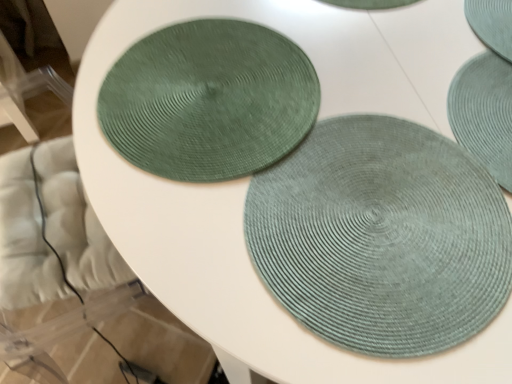
Describe the element at coordinates (209, 100) in the screenshot. This screenshot has height=384, width=512. I see `green woven coaster at upper left, the 1th coaster when ordered from left to right` at that location.

Image resolution: width=512 pixels, height=384 pixels. What do you see at coordinates (492, 24) in the screenshot? I see `teal woven coaster at upper right, positioned as the 2th coaster in left-to-right order` at bounding box center [492, 24].

Where is `green woven coaster at upper left, the 1th coaster when ordered from left to right`? The height and width of the screenshot is (384, 512). green woven coaster at upper left, the 1th coaster when ordered from left to right is located at coordinates (209, 100).

Which is more to the left, sage green woven mat at center, placed as the second mat when sorted from back to front, or teal woven coaster at upper right, the first coaster when ordered from right to left?

sage green woven mat at center, placed as the second mat when sorted from back to front, is more to the left.

Does sage green woven mat at center, arranged as the 1th mat when viewed from the front, touch teal woven coaster at upper right, the first coaster when ordered from right to left?

sage green woven mat at center, arranged as the 1th mat when viewed from the front, and teal woven coaster at upper right, the first coaster when ordered from right to left, are not in contact.

Which of these two, sage green woven mat at center, placed as the second mat when sorted from back to front, or teal woven coaster at upper right, positioned as the 2th coaster in left-to-right order, is bigger?

With larger size is sage green woven mat at center, placed as the second mat when sorted from back to front.

Which object is further away from the camera, teal woven coaster at upper right, the first coaster when ordered from right to left, or sage green woven mat at center, placed as the second mat when sorted from front to back?

teal woven coaster at upper right, the first coaster when ordered from right to left, is behind.

Who is bigger, teal woven coaster at upper right, the first coaster when ordered from right to left, or sage green woven mat at center, positioned as the 1th mat in back-to-front order?

teal woven coaster at upper right, the first coaster when ordered from right to left, is bigger.

From the image's perspective, is teal woven coaster at upper right, positioned as the 2th coaster in left-to-right order, on sage green woven mat at center, positioned as the 1th mat in back-to-front order?

Yes, from the image's perspective, teal woven coaster at upper right, positioned as the 2th coaster in left-to-right order, is on top of sage green woven mat at center, positioned as the 1th mat in back-to-front order.

Does sage green woven mat at center, arranged as the 1th mat when viewed from the front, appear on the right side of sage green woven mat at center, positioned as the 1th mat in back-to-front order?

In fact, sage green woven mat at center, arranged as the 1th mat when viewed from the front, is to the left of sage green woven mat at center, positioned as the 1th mat in back-to-front order.

Is sage green woven mat at center, placed as the second mat when sorted from back to front, further to the viewer compared to sage green woven mat at center, positioned as the 1th mat in back-to-front order?

No, it is in front of sage green woven mat at center, positioned as the 1th mat in back-to-front order.

Does point (404, 294) appear closer or farther from the camera than point (505, 67)?

Point (404, 294) is closer to the camera than point (505, 67).

Between sage green woven mat at center, placed as the second mat when sorted from back to front, and sage green woven mat at center, placed as the second mat when sorted from front to back, which one has smaller width?

sage green woven mat at center, placed as the second mat when sorted from front to back.

Is teal woven coaster at upper right, the first coaster when ordered from right to left, oriented towards green woven coaster at upper left, arranged as the 2th coaster when viewed from the right?

No, teal woven coaster at upper right, the first coaster when ordered from right to left, is not facing towards green woven coaster at upper left, arranged as the 2th coaster when viewed from the right.

From a real-world perspective, does teal woven coaster at upper right, positioned as the 2th coaster in left-to-right order, stand above green woven coaster at upper left, arranged as the 2th coaster when viewed from the right?

Indeed, from a real-world perspective, teal woven coaster at upper right, positioned as the 2th coaster in left-to-right order, stands above green woven coaster at upper left, arranged as the 2th coaster when viewed from the right.

Is teal woven coaster at upper right, positioned as the 2th coaster in left-to-right order, located outside green woven coaster at upper left, arranged as the 2th coaster when viewed from the right?

Yes.

Considering the points (490, 34) and (215, 38), which point is in front, point (490, 34) or point (215, 38)?

The point (215, 38) is in front.

Can you confirm if green woven coaster at upper left, arranged as the 2th coaster when viewed from the right, is shorter than sage green woven mat at center, positioned as the 1th mat in back-to-front order?

Yes, green woven coaster at upper left, arranged as the 2th coaster when viewed from the right, is shorter than sage green woven mat at center, positioned as the 1th mat in back-to-front order.

Measure the distance between green woven coaster at upper left, arranged as the 2th coaster when viewed from the right, and sage green woven mat at center, positioned as the 1th mat in back-to-front order.

A distance of 38.61 centimeters exists between green woven coaster at upper left, arranged as the 2th coaster when viewed from the right, and sage green woven mat at center, positioned as the 1th mat in back-to-front order.

Is green woven coaster at upper left, arranged as the 2th coaster when viewed from the right, outside of sage green woven mat at center, positioned as the 1th mat in back-to-front order?

green woven coaster at upper left, arranged as the 2th coaster when viewed from the right, is positioned outside sage green woven mat at center, positioned as the 1th mat in back-to-front order.

Considering the relative positions of green woven coaster at upper left, arranged as the 2th coaster when viewed from the right, and sage green woven mat at center, positioned as the 1th mat in back-to-front order, in the image provided, is green woven coaster at upper left, arranged as the 2th coaster when viewed from the right, to the right of sage green woven mat at center, positioned as the 1th mat in back-to-front order, from the viewer's perspective?

In fact, green woven coaster at upper left, arranged as the 2th coaster when viewed from the right, is to the left of sage green woven mat at center, positioned as the 1th mat in back-to-front order.

Which of these two, green woven coaster at upper left, the 1th coaster when ordered from left to right, or sage green woven mat at center, arranged as the 1th mat when viewed from the front, is wider?

Wider between the two is sage green woven mat at center, arranged as the 1th mat when viewed from the front.

Consider the image. Can you see green woven coaster at upper left, arranged as the 2th coaster when viewed from the right, touching sage green woven mat at center, arranged as the 1th mat when viewed from the front?

No, green woven coaster at upper left, arranged as the 2th coaster when viewed from the right, is not touching sage green woven mat at center, arranged as the 1th mat when viewed from the front.

From the picture: Is green woven coaster at upper left, the 1th coaster when ordered from left to right, oriented away from sage green woven mat at center, placed as the second mat when sorted from back to front?

green woven coaster at upper left, the 1th coaster when ordered from left to right, is not turned away from sage green woven mat at center, placed as the second mat when sorted from back to front.

Considering the sizes of objects green woven coaster at upper left, the 1th coaster when ordered from left to right, and sage green woven mat at center, arranged as the 1th mat when viewed from the front, in the image provided, who is taller, green woven coaster at upper left, the 1th coaster when ordered from left to right, or sage green woven mat at center, arranged as the 1th mat when viewed from the front,?

With more height is sage green woven mat at center, arranged as the 1th mat when viewed from the front.

Which is behind, sage green woven mat at center, positioned as the 1th mat in back-to-front order, or green woven coaster at upper left, the 1th coaster when ordered from left to right?

green woven coaster at upper left, the 1th coaster when ordered from left to right, is behind.

Is sage green woven mat at center, placed as the second mat when sorted from front to back, to the right of green woven coaster at upper left, the 1th coaster when ordered from left to right, from the viewer's perspective?

Indeed, sage green woven mat at center, placed as the second mat when sorted from front to back, is positioned on the right side of green woven coaster at upper left, the 1th coaster when ordered from left to right.

How much distance is there between sage green woven mat at center, placed as the second mat when sorted from front to back, and green woven coaster at upper left, the 1th coaster when ordered from left to right?

15.20 inches.

From the image's perspective, which is above, sage green woven mat at center, positioned as the 1th mat in back-to-front order, or green woven coaster at upper left, the 1th coaster when ordered from left to right?

green woven coaster at upper left, the 1th coaster when ordered from left to right.

You are a GUI agent. You are given a task and a screenshot of the screen. Output one action in this format:
    pyautogui.click(x=<x>, y=<y>)
    Task: Click on the 2nd mat located beneath the teal woven coaster at upper right, positioned as the 2th coaster in left-to-right order (from a real-world perspective)
    
    Given the screenshot: What is the action you would take?
    pyautogui.click(x=382, y=237)

This screenshot has width=512, height=384. I want to click on the 2nd coaster behind the sage green woven mat at center, positioned as the 1th mat in back-to-front order, starting your count from the anchor, so click(492, 24).

Looking at the image, which one is located closer to green woven coaster at upper left, arranged as the 2th coaster when viewed from the right, teal woven coaster at upper right, positioned as the 2th coaster in left-to-right order, or sage green woven mat at center, placed as the second mat when sorted from front to back?

sage green woven mat at center, placed as the second mat when sorted from front to back, lies closer to green woven coaster at upper left, arranged as the 2th coaster when viewed from the right, than the other object.

Considering their positions, is sage green woven mat at center, placed as the second mat when sorted from front to back, positioned closer to teal woven coaster at upper right, the first coaster when ordered from right to left, than green woven coaster at upper left, the 1th coaster when ordered from left to right?

Among the two, sage green woven mat at center, placed as the second mat when sorted from front to back, is located nearer to teal woven coaster at upper right, the first coaster when ordered from right to left.

Considering their positions, is green woven coaster at upper left, the 1th coaster when ordered from left to right, positioned further to sage green woven mat at center, placed as the second mat when sorted from back to front, than sage green woven mat at center, positioned as the 1th mat in back-to-front order?

sage green woven mat at center, positioned as the 1th mat in back-to-front order, is further to sage green woven mat at center, placed as the second mat when sorted from back to front.

Looking at the image, which one is located further to teal woven coaster at upper right, positioned as the 2th coaster in left-to-right order, green woven coaster at upper left, the 1th coaster when ordered from left to right, or sage green woven mat at center, placed as the second mat when sorted from back to front?

green woven coaster at upper left, the 1th coaster when ordered from left to right, is positioned further to the anchor teal woven coaster at upper right, positioned as the 2th coaster in left-to-right order.

When comparing their distances from sage green woven mat at center, positioned as the 1th mat in back-to-front order, does teal woven coaster at upper right, the first coaster when ordered from right to left, or green woven coaster at upper left, arranged as the 2th coaster when viewed from the right, seem closer?

teal woven coaster at upper right, the first coaster when ordered from right to left, is closer to sage green woven mat at center, positioned as the 1th mat in back-to-front order.

Based on their spatial positions, is sage green woven mat at center, placed as the second mat when sorted from back to front, or teal woven coaster at upper right, the first coaster when ordered from right to left, further from sage green woven mat at center, placed as the second mat when sorted from front to back?

sage green woven mat at center, placed as the second mat when sorted from back to front, is positioned further to the anchor sage green woven mat at center, placed as the second mat when sorted from front to back.

Estimate the real-world distances between objects in this image. Which object is closer to teal woven coaster at upper right, positioned as the 2th coaster in left-to-right order, green woven coaster at upper left, the 1th coaster when ordered from left to right, or sage green woven mat at center, positioned as the 1th mat in back-to-front order?

sage green woven mat at center, positioned as the 1th mat in back-to-front order, is positioned closer to the anchor teal woven coaster at upper right, positioned as the 2th coaster in left-to-right order.

When comparing their distances from sage green woven mat at center, arranged as the 1th mat when viewed from the front, does green woven coaster at upper left, arranged as the 2th coaster when viewed from the right, or teal woven coaster at upper right, the first coaster when ordered from right to left, seem closer?

Based on the image, green woven coaster at upper left, arranged as the 2th coaster when viewed from the right, appears to be nearer to sage green woven mat at center, arranged as the 1th mat when viewed from the front.

You are a GUI agent. You are given a task and a screenshot of the screen. Output one action in this format:
    pyautogui.click(x=<x>, y=<y>)
    Task: Click on the mat between teal woven coaster at upper right, the first coaster when ordered from right to left, and sage green woven mat at center, arranged as the 1th mat when viewed from the front, vertically
    
    Given the screenshot: What is the action you would take?
    pyautogui.click(x=484, y=113)

You are a GUI agent. You are given a task and a screenshot of the screen. Output one action in this format:
    pyautogui.click(x=<x>, y=<y>)
    Task: Click on the mat situated between green woven coaster at upper left, the 1th coaster when ordered from left to right, and sage green woven mat at center, positioned as the 1th mat in back-to-front order, from left to right
    The width and height of the screenshot is (512, 384).
    Given the screenshot: What is the action you would take?
    pyautogui.click(x=382, y=237)